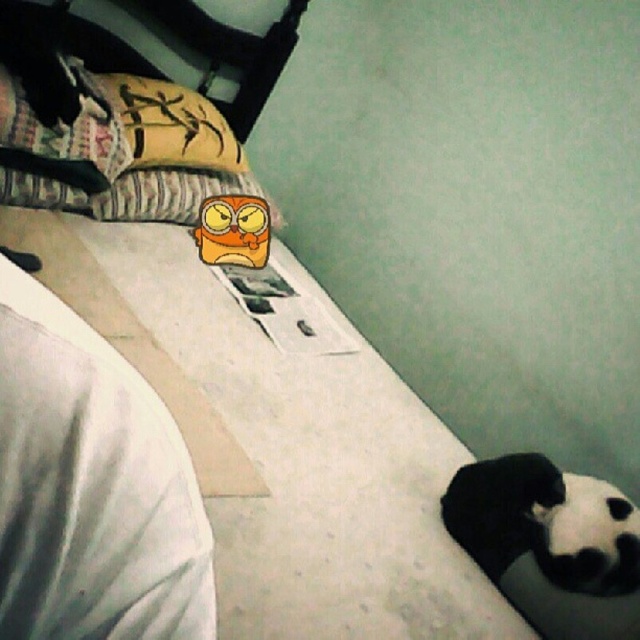
Does point (496, 577) lie in front of point (243, 260)?

Yes, point (496, 577) is closer to viewer.

Is black plush panda at lower right taller than orange plush toy at center?

Correct, black plush panda at lower right is much taller as orange plush toy at center.

Is point (506, 525) closer to camera compared to point (243, 234)?

Yes, point (506, 525) is closer to viewer.

Find the location of a particular element. This screenshot has width=640, height=640. black plush panda at lower right is located at coordinates (545, 522).